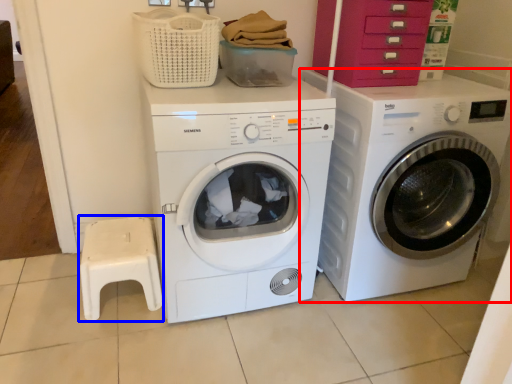
Question: Which object is further to the camera taking this photo, washing machine (highlighted by a red box) or step stool (highlighted by a blue box)?

Choices:
 (A) washing machine
 (B) step stool

Answer: (B)